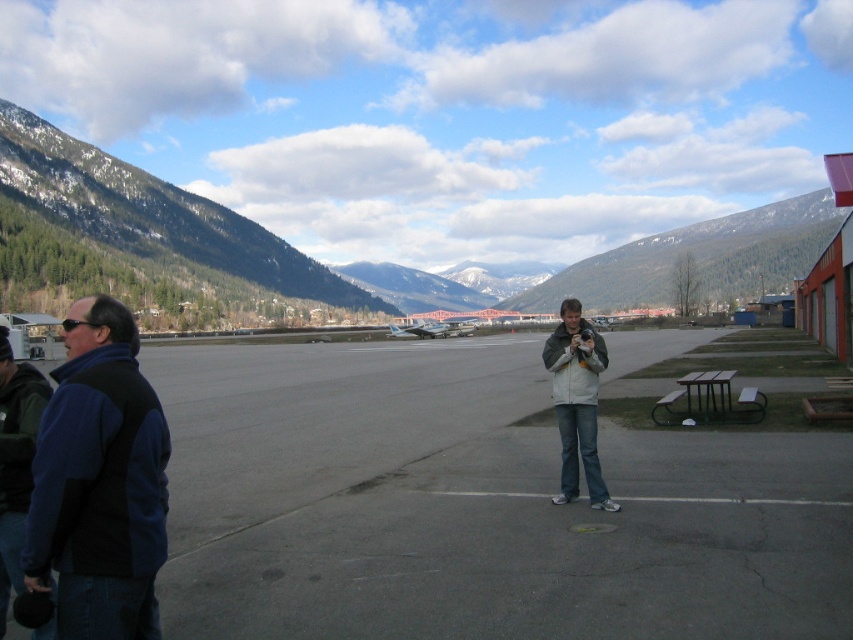
Question: Estimate the real-world distances between objects in this image. Which object is closer to the light gray fleece jacket at center?

Choices:
 (A) gray asphalt tarmac at center
 (B) green forested mountain at left

Answer: (A)

Question: Is snowy forested mountain at center in front of light gray fleece jacket at center?

Choices:
 (A) yes
 (B) no

Answer: (B)

Question: Among these objects, which one is farthest from the camera?

Choices:
 (A) gray asphalt tarmac at center
 (B) blue fleece vest at left

Answer: (A)

Question: Can you confirm if green forested mountain at left is bigger than blue fleece vest at left?

Choices:
 (A) yes
 (B) no

Answer: (A)

Question: Where is snowy forested mountain at center located in relation to light gray fleece jacket at center in the image?

Choices:
 (A) below
 (B) above

Answer: (B)

Question: Which point is closer to the camera?

Choices:
 (A) (527, 524)
 (B) (590, 259)
 (C) (579, 449)

Answer: (A)